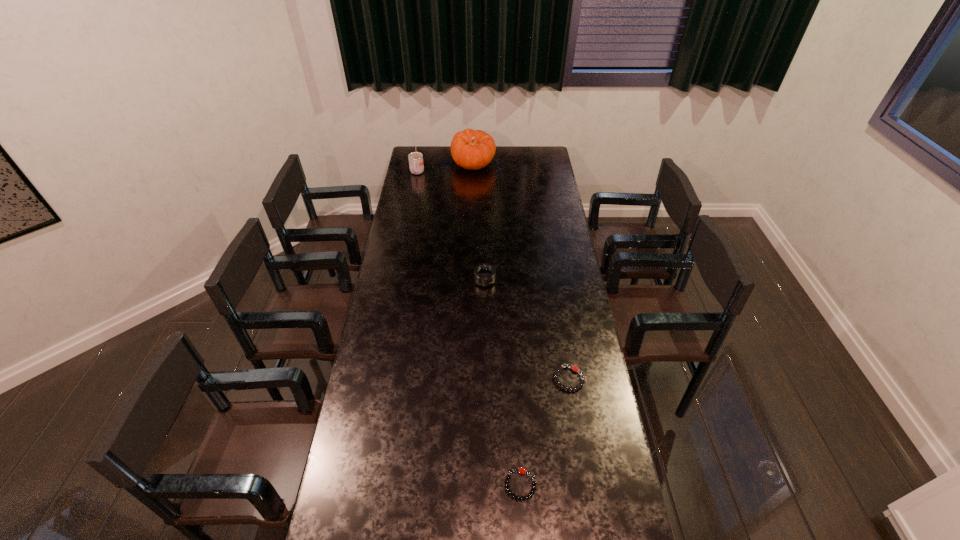
Identify the location of the tallest object. 472,150.

This screenshot has width=960, height=540. In order to click on the fourth shortest object in this screenshot , I will do `click(416, 166)`.

The image size is (960, 540). Find the location of `the leftmost object`. the leftmost object is located at coordinates (416, 166).

At what (x,y) coordinates should I click in order to perform the action: click on the third tallest object. Please return your answer as a coordinate pair (x, y). Looking at the image, I should click on (484, 274).

Where is `telephoto lens`? This screenshot has width=960, height=540. telephoto lens is located at coordinates (484, 274).

What are the coordinates of `the farther bracelet` in the screenshot? It's located at (560, 368).

The height and width of the screenshot is (540, 960). In order to click on the rightmost object in this screenshot , I will do `click(560, 368)`.

At what (x,y) coordinates should I click in order to perform the action: click on the shortest object. Please return your answer as a coordinate pair (x, y). Looking at the image, I should click on (521, 470).

At what (x,y) coordinates should I click in order to perform the action: click on the left bracelet. Please return your answer as a coordinate pair (x, y). The height and width of the screenshot is (540, 960). Looking at the image, I should click on (521, 470).

The height and width of the screenshot is (540, 960). Find the location of `vacant space located 0.270m on the left of the tallest object`. vacant space located 0.270m on the left of the tallest object is located at coordinates (407, 164).